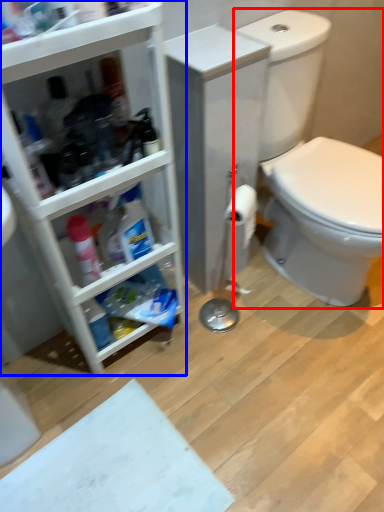
Question: Which of the following is the farthest to the observer, sit (highlighted by a red box) or bathroom cabinet (highlighted by a blue box)?

Choices:
 (A) sit
 (B) bathroom cabinet

Answer: (A)